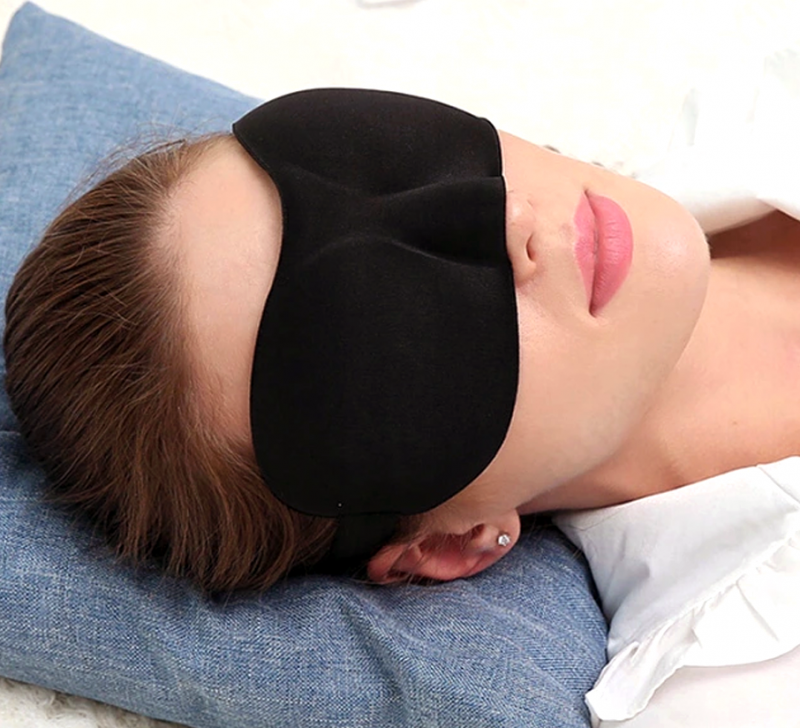
Identify the location of blue pillow. (249, 632).